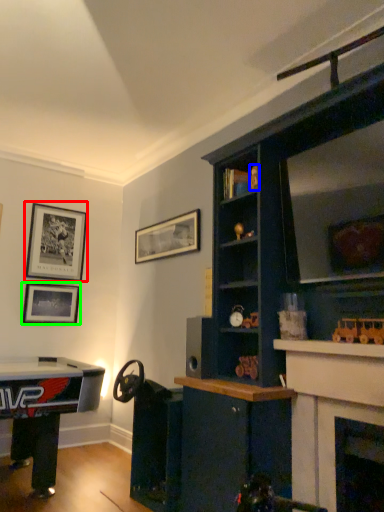
Question: Estimate the real-world distances between objects in this image. Which object is farther from picture frame (highlighted by a red box), toy (highlighted by a blue box) or picture frame (highlighted by a green box)?

Choices:
 (A) toy
 (B) picture frame

Answer: (A)